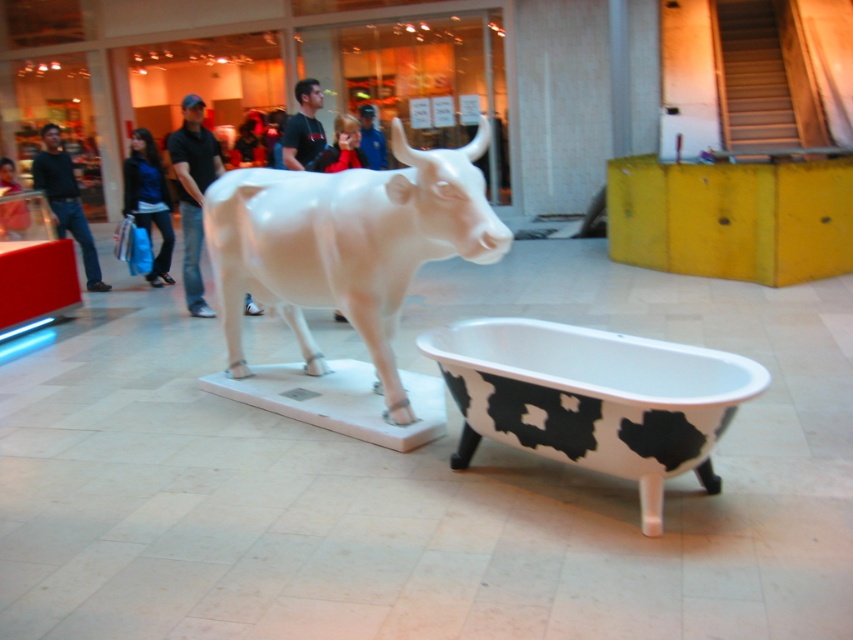
You are standing in the shopping mall and see the black jeans at left and the blue fabric jacket at center. Which item is closer to you?

The black jeans at left is closer to you because it is in front of the blue fabric jacket at center.

Which object is located at the coordinates point (148,200)?

The matte black jacket at left is located at point (148,200).

You are an interior designer arranging items in a room. You have a white glossy bull at center and a black cotton shirt at center. According to the scene description, which object is positioned to the right of the other?

The white glossy bull at center is positioned to the right of the black cotton shirt at center.